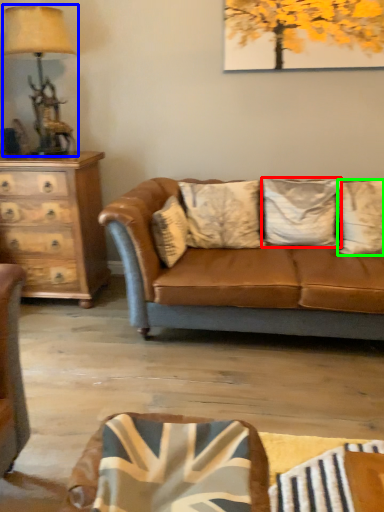
Question: Which object is positioned closest to pillow (highlighted by a red box)? Select from table lamp (highlighted by a blue box) and pillow (highlighted by a green box).

Choices:
 (A) table lamp
 (B) pillow

Answer: (B)